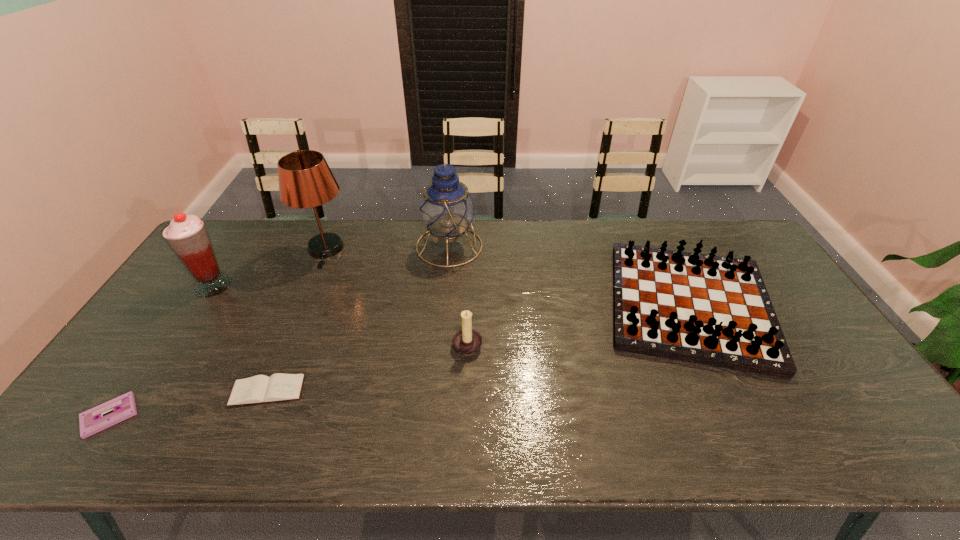
Locate an element on the screen. The image size is (960, 540). lampshade is located at coordinates (305, 180).

You are a GUI agent. You are given a task and a screenshot of the screen. Output one action in this format:
    pyautogui.click(x=<x>, y=<y>)
    Task: Click on the lantern
    The height and width of the screenshot is (540, 960).
    Given the screenshot: What is the action you would take?
    coord(447,209)

At what (x,y) coordinates should I click in order to perform the action: click on the fifth shortest object. Please return your answer as a coordinate pair (x, y). The image size is (960, 540). Looking at the image, I should click on (187, 236).

Locate an element on the screen. Image resolution: width=960 pixels, height=540 pixels. candle holder is located at coordinates (467, 341).

Locate an element on the screen. Image resolution: width=960 pixels, height=540 pixels. chessboard is located at coordinates point(706,309).

Where is `the rightmost object`? This screenshot has width=960, height=540. the rightmost object is located at coordinates (706, 309).

Identify the location of diary. (262, 389).

This screenshot has width=960, height=540. In order to click on videotape in this screenshot , I will do `click(91, 421)`.

Locate an element on the screen. vacant space located on the front-facing side of the lampshade is located at coordinates (288, 339).

In order to click on free space located on the front-facing side of the lantern in this screenshot , I will do pyautogui.click(x=586, y=246).